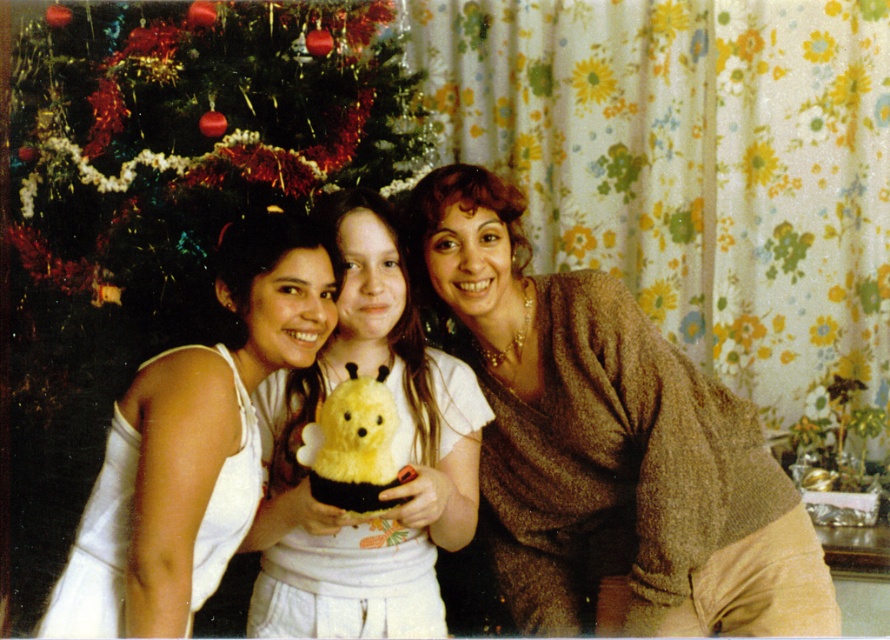
Question: Which point is farther to the camera?

Choices:
 (A) (330, 464)
 (B) (160, 564)

Answer: (A)

Question: Is white fabric at left bigger than yellow fuzzy plush bee at center?

Choices:
 (A) no
 (B) yes

Answer: (B)

Question: Which object appears farthest from the camera in this image?

Choices:
 (A) white fabric at left
 (B) yellow fuzzy plush bee at center
 (C) yellow plush bear at center

Answer: (C)

Question: Based on their relative distances, which object is nearer to the brown textured sweater at center?

Choices:
 (A) white fabric at left
 (B) yellow fuzzy plush bee at center
 (C) yellow plush bear at center
 (D) green textured christmas tree at upper left

Answer: (C)

Question: Can you confirm if white fabric at left is wider than yellow fuzzy plush bee at center?

Choices:
 (A) no
 (B) yes

Answer: (B)

Question: Does green textured christmas tree at upper left have a smaller size compared to brown textured sweater at center?

Choices:
 (A) yes
 (B) no

Answer: (B)